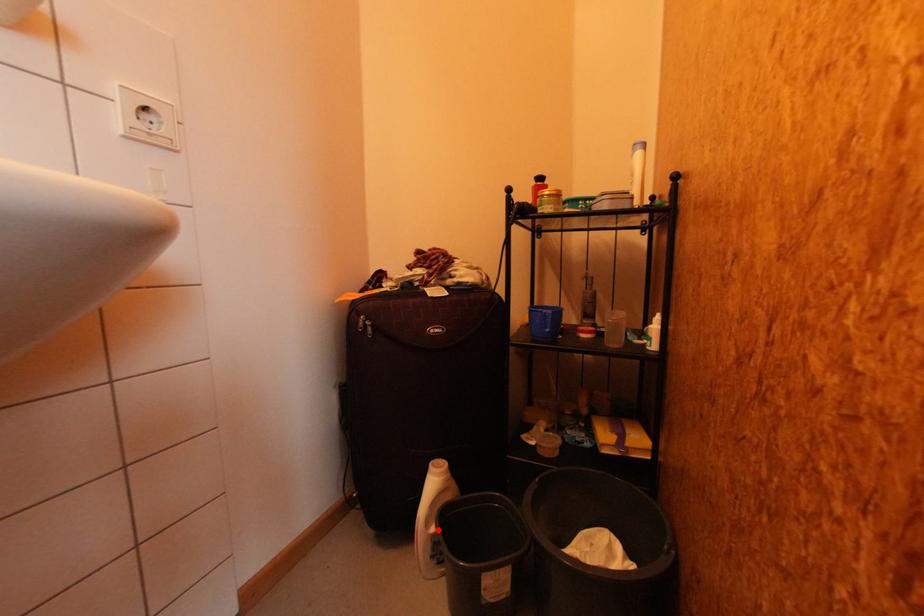
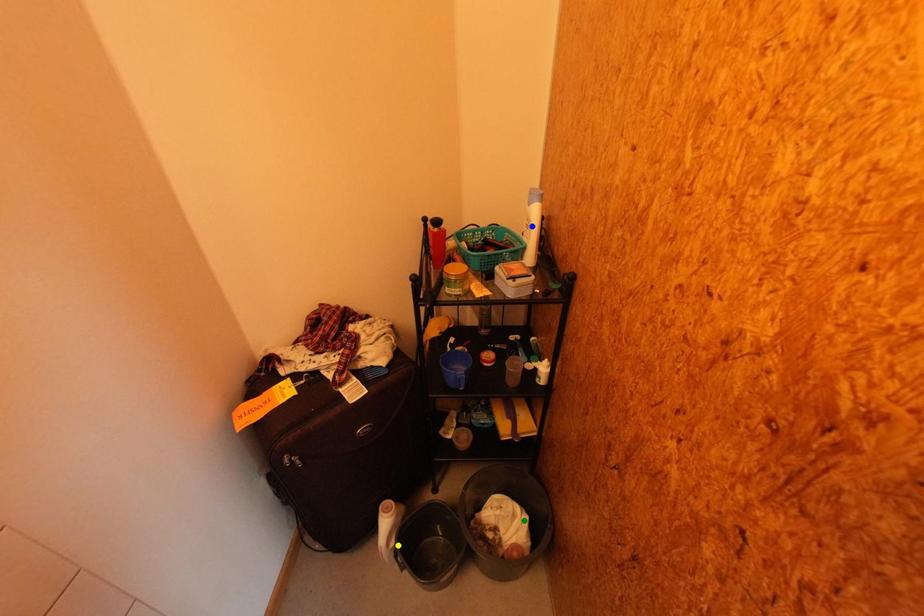
Question: I am providing you with two images of the same scene from different viewpoints. A red point is marked on the first image. You are given multiple points on the second image. Which mark in image 2 goes with the point in image 1?

Choices:
 (A) green point
 (B) yellow point
 (C) blue point

Answer: (B)